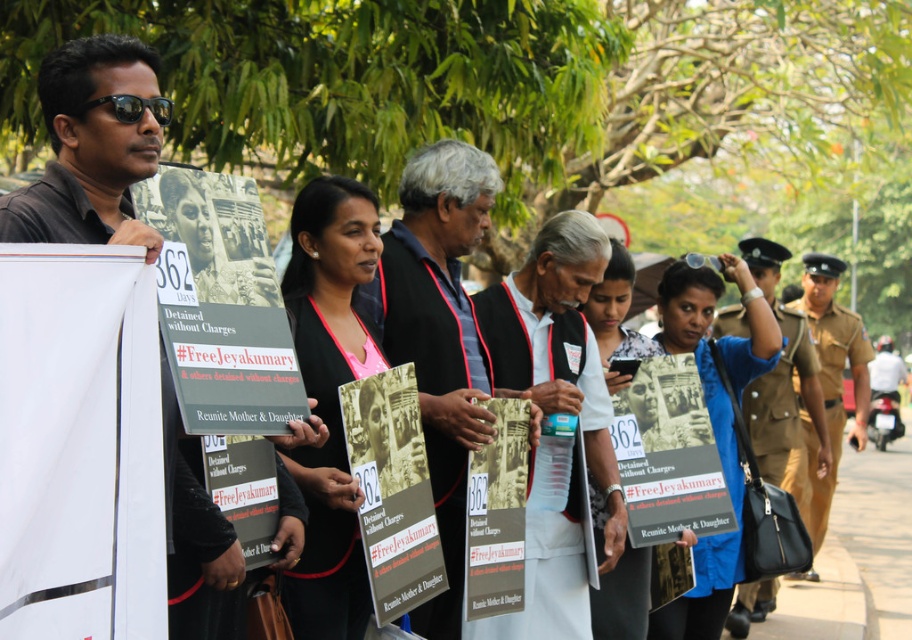
You are standing at the point labeled point (323, 588), and you want to take a photo of the protest signs with your camera. The camera is 14.33 feet away from you. If your camera has a maximum focus range of 15 feet, will you be able to capture the signs clearly?

The camera is 14.33 feet away from point (323, 588), which is within the camera maximum focus range of 15 feet. Therefore, you can capture the signs clearly.

You are a photographer at the protest scene. You want to take a photo that includes both the white cloth vest at center and the matte black signboard at center. Which object will appear bigger in the photo?

The white cloth vest at center will appear bigger in the photo because it is larger in size than the matte black signboard at center.

You are a photographer trying to capture a photo of the protest. You notice the white cloth vest at center and the matte black signboard at center. Which object should you focus on to ensure it fits entirely within the frame if your camera has a limited horizontal field of view?

The white cloth vest at center has a greater width than the matte black signboard at center. To ensure it fits entirely within the frame, you should focus on the white cloth vest at center.